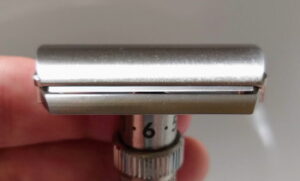
You are a GUI agent. You are given a task and a screenshot of the screen. Output one action in this format:
    pyautogui.click(x=<x>, y=<y>)
    Task: Click on the light
    This screenshot has height=181, width=300.
    Given the screenshot: What is the action you would take?
    pyautogui.click(x=147, y=71)